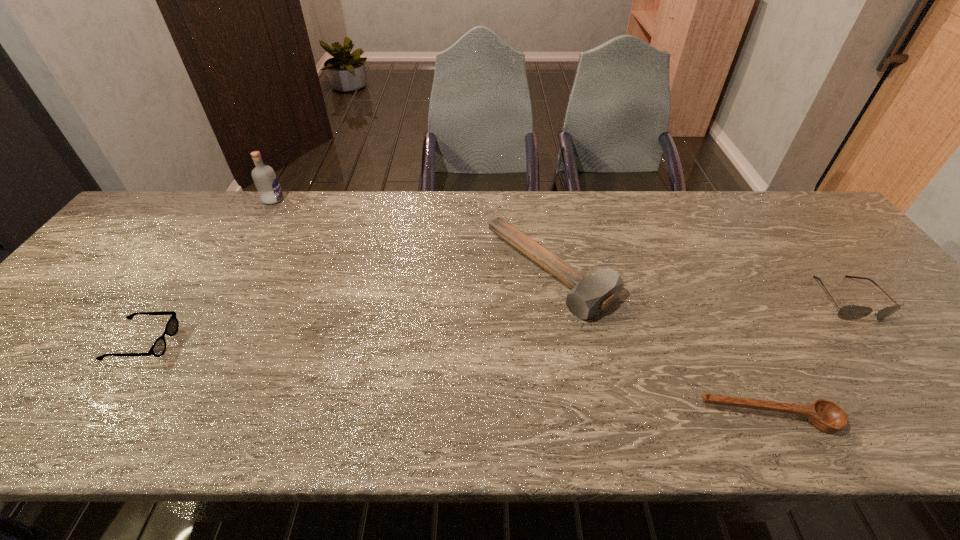
Image resolution: width=960 pixels, height=540 pixels. Identify the location of the farthest object. (264, 177).

Where is `vodka`? The width and height of the screenshot is (960, 540). vodka is located at coordinates (264, 177).

The image size is (960, 540). I want to click on the third object from left to right, so click(x=591, y=294).

Image resolution: width=960 pixels, height=540 pixels. I want to click on mallet, so click(x=591, y=294).

Locate an element on the screen. The height and width of the screenshot is (540, 960). the rightmost object is located at coordinates (848, 312).

Find the location of a particular element. sunglasses is located at coordinates (848, 312).

Locate an element on the screen. Image resolution: width=960 pixels, height=540 pixels. the leftmost object is located at coordinates (158, 348).

Where is `the fourth object from left to right`? the fourth object from left to right is located at coordinates (826, 416).

Find the location of a particular element. Image resolution: width=960 pixels, height=540 pixels. the nearest object is located at coordinates (826, 416).

Where is `vacant area located on the label of the vodka`? The image size is (960, 540). vacant area located on the label of the vodka is located at coordinates (351, 200).